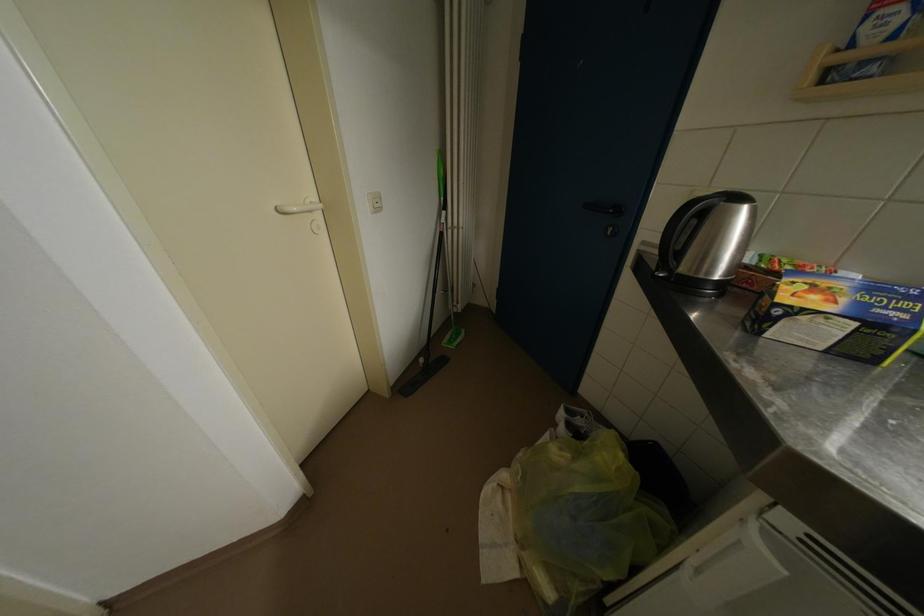
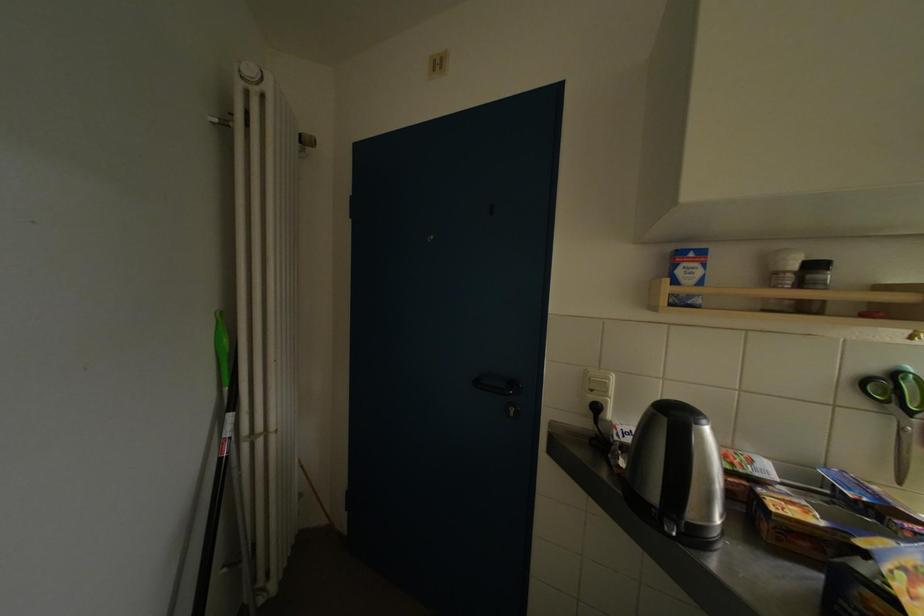
The images are taken continuously from a first-person perspective. In which direction is your viewpoint rotating?

The rotation direction of the camera is right-up.